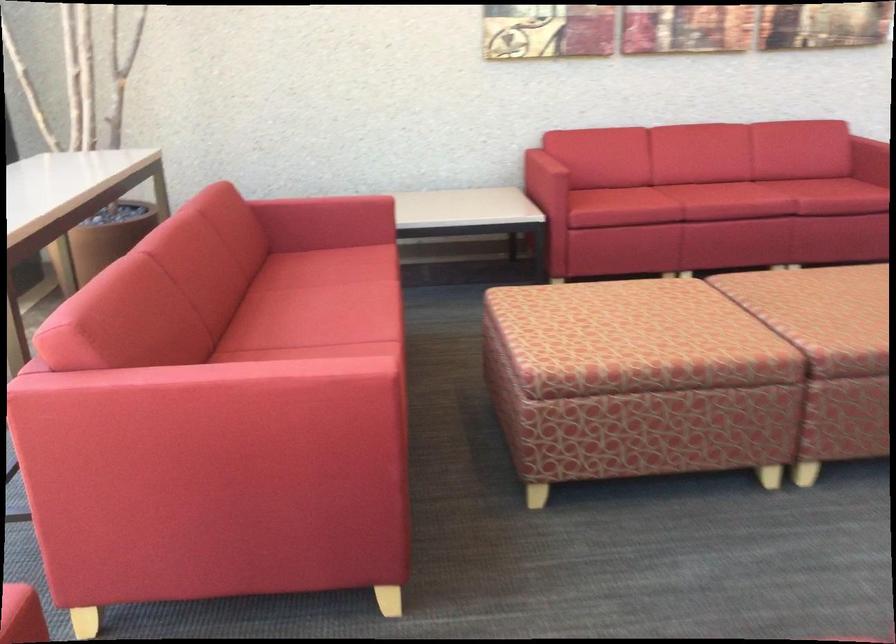
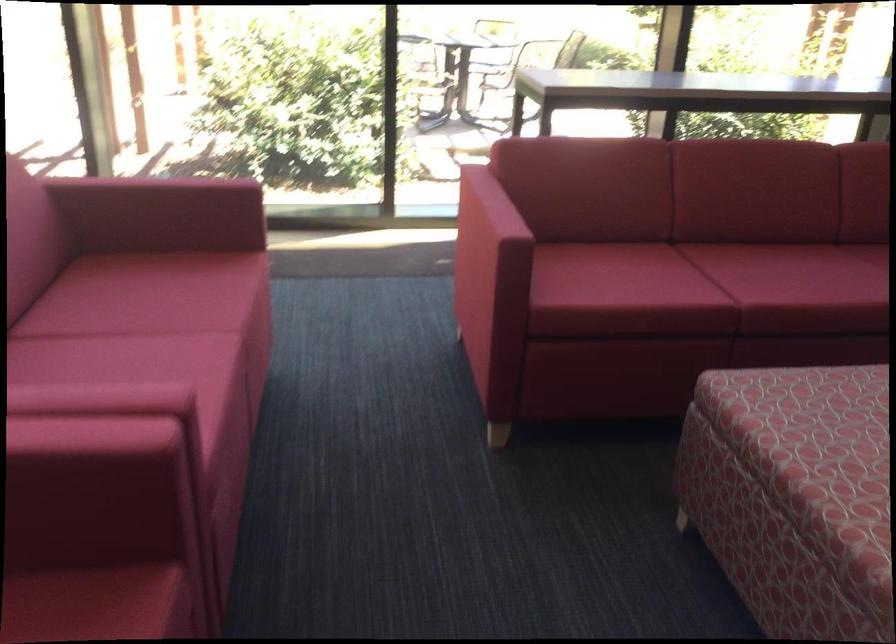
In the second image, find the point that corresponds to the point at 316,334 in the first image.

(728, 269)